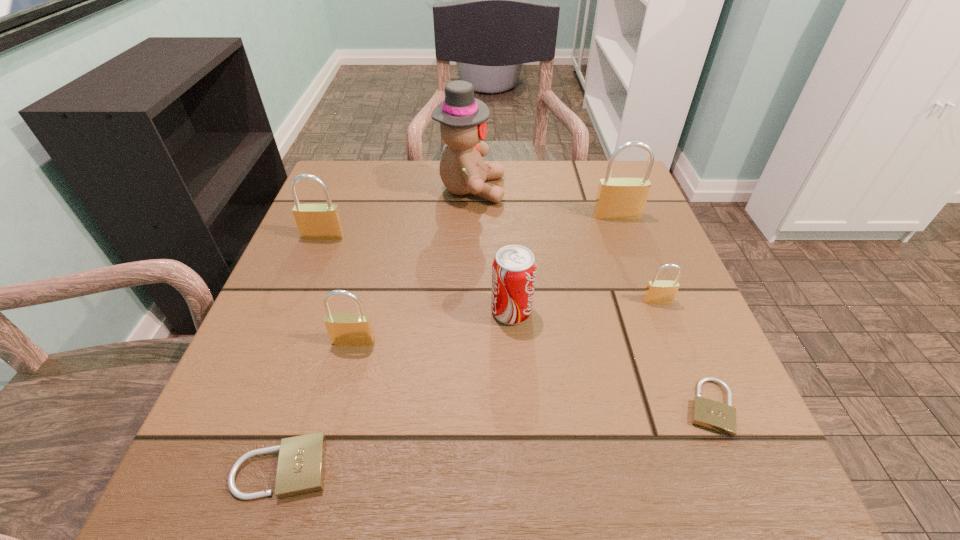
You are a GUI agent. You are given a task and a screenshot of the screen. Output one action in this format:
    pyautogui.click(x=<x>, y=<y>)
    Task: Click on the seventh tallest object
    This screenshot has width=960, height=540.
    Given the screenshot: What is the action you would take?
    [301, 463]

Identify the location of the bigger beige padlock. (301, 463).

This screenshot has width=960, height=540. I want to click on the shortest object, so click(712, 415).

You are a GUI agent. You are given a task and a screenshot of the screen. Output one action in this format:
    pyautogui.click(x=<x>, y=<y>)
    Task: Click on the right beige padlock
    The width and height of the screenshot is (960, 540).
    Given the screenshot: What is the action you would take?
    coord(712,415)

Find the location of a particular element. Image resolution: width=960 pixels, height=540 pixels. free space located 0.190m on the front-facing side of the tallest object is located at coordinates (583, 189).

Identify the location of free spot located 0.050m on the front-facing side of the seventh shortest object. This screenshot has height=540, width=960. (624, 234).

At what (x,y) coordinates should I click in order to perform the action: click on vacant space located 0.320m on the front-facing side of the second biggest brass padlock. Please return your answer as a coordinate pair (x, y). Looking at the image, I should click on 270,367.

Image resolution: width=960 pixels, height=540 pixels. In order to click on blank space located 0.070m on the right of the soda can in this screenshot , I will do `click(570, 312)`.

Locate an element on the screen. This screenshot has height=540, width=960. vacant space situated 0.090m on the front-facing side of the third nearest object is located at coordinates (340, 394).

The image size is (960, 540). What are the coordinates of `vacant region located 0.300m on the front-facing side of the sixth tallest object` in the screenshot? It's located at coord(725,471).